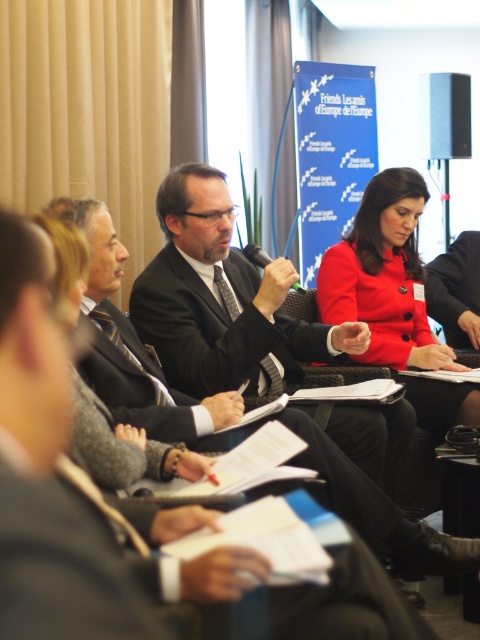
Question: Which is nearer to the black fabric business suit at center?

Choices:
 (A) matte red coat at center
 (B) matte black suit at center

Answer: (A)

Question: Does black fabric business suit at center have a larger size compared to dark gray suit at center?

Choices:
 (A) no
 (B) yes

Answer: (A)

Question: Is matte red coat at center above matte black suit at center?

Choices:
 (A) no
 (B) yes

Answer: (A)

Question: Which point is closer to the camera?

Choices:
 (A) dark gray suit at center
 (B) black fabric business suit at center

Answer: (B)

Question: Based on their relative distances, which object is farther from the dark gray suit at center?

Choices:
 (A) matte black suit at center
 (B) matte red coat at center

Answer: (A)

Question: Does black fabric business suit at center appear under matte black suit at center?

Choices:
 (A) yes
 (B) no

Answer: (A)